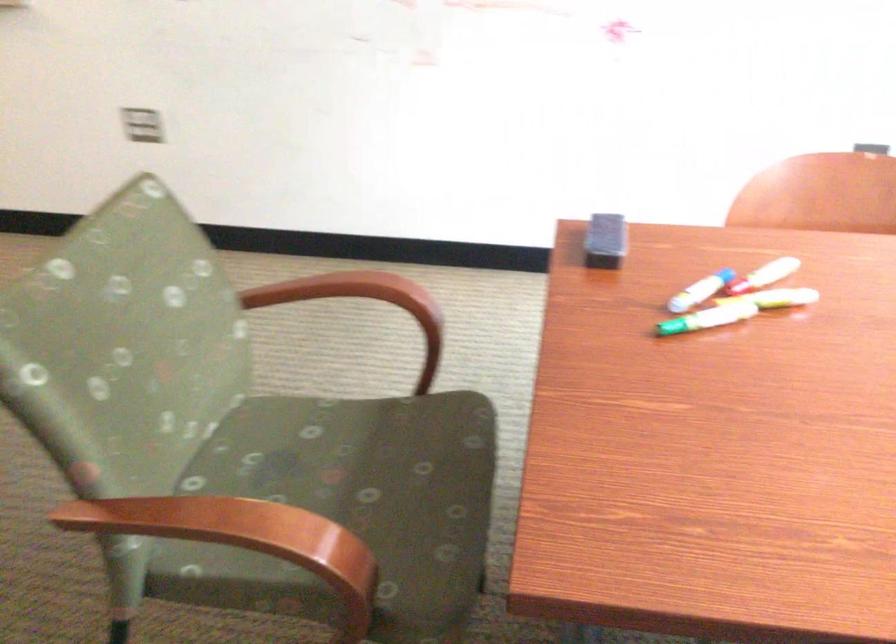
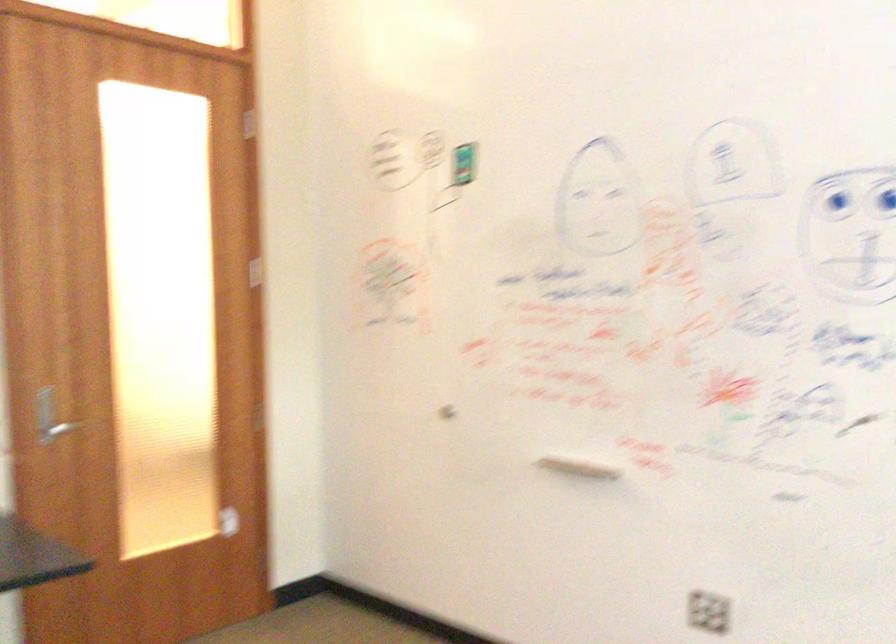
The first image is from the beginning of the video and the second image is from the end. How did the camera likely rotate when shooting the video?

The camera's rotation is toward left-up.